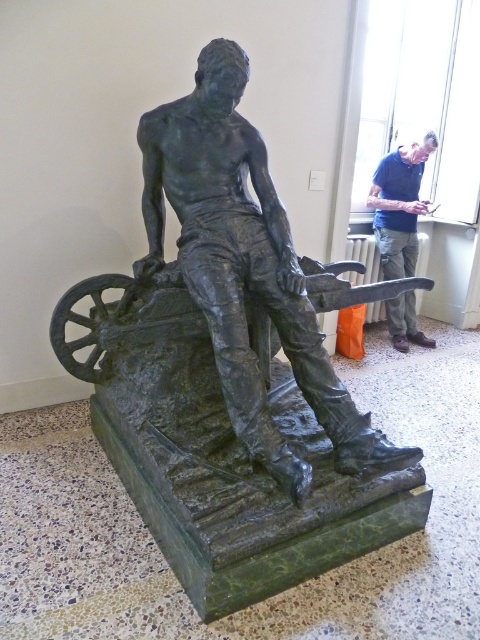
Can you confirm if bronze statue at center is bigger than blue shirt at upper right?

Indeed, bronze statue at center has a larger size compared to blue shirt at upper right.

Which is in front, point (164, 403) or point (414, 240)?

Point (164, 403)

Which is behind, point (332, 496) or point (405, 348)?

Positioned behind is point (405, 348).

Where is `bronze statue at center`? This screenshot has width=480, height=640. bronze statue at center is located at coordinates (233, 371).